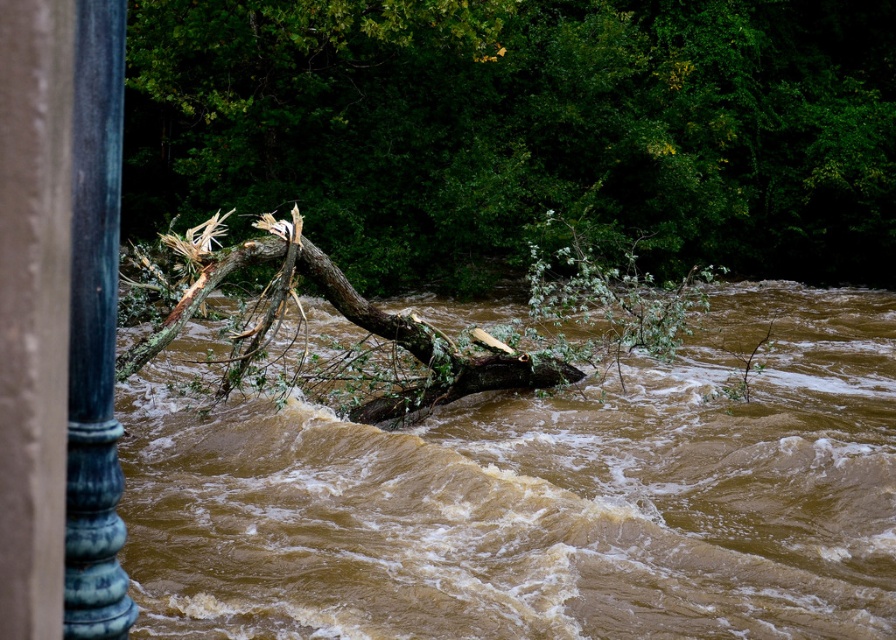
You are a hiker trying to cross the flooded river. You see a brown wood tree at center and a blue polished metal pole at left. Which object is closer to you as you stand on the riverbank?

The brown wood tree at center is closer to you because it is further to the viewer than the blue polished metal pole at left, meaning it appears nearer in the scene.

You are a hiker trying to cross the flooded river. You see the brown muddy water at center and the brown wood tree at center. How far apart are these two landmarks?

The brown muddy water at center is 7.95 meters from the brown wood tree at center.